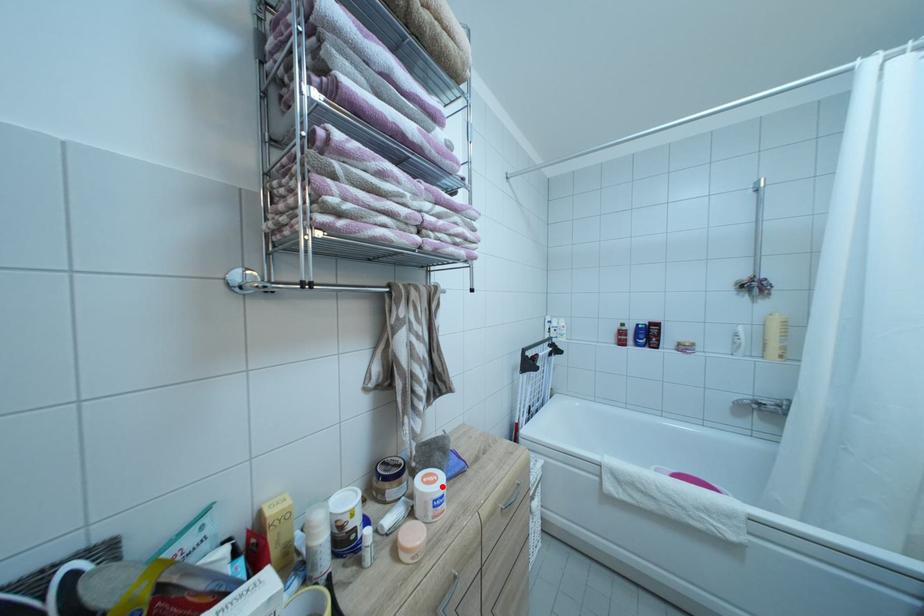
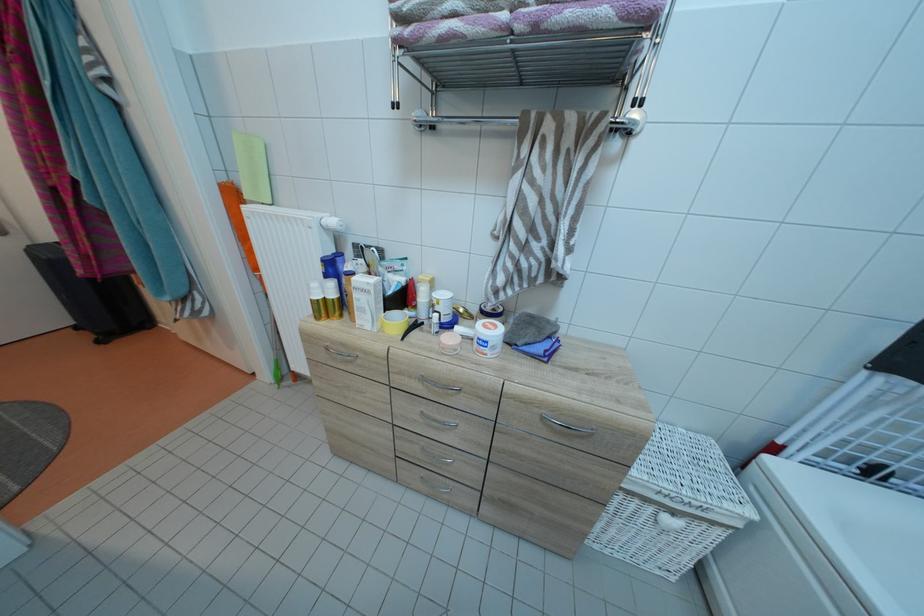
The point at the highlighted location is marked in the first image. Where is the corresponding point in the second image?

(496, 334)